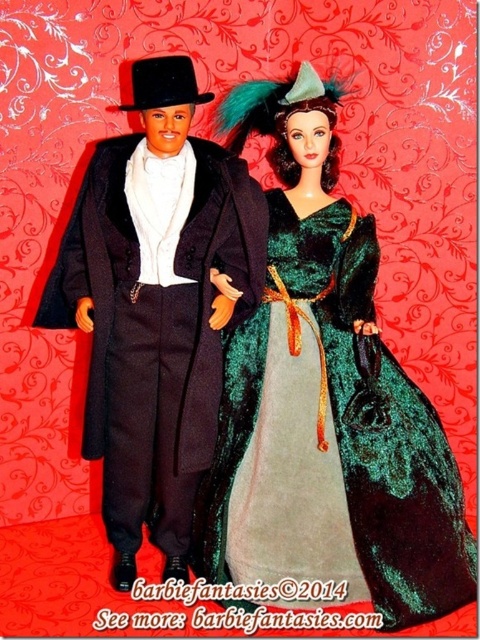
Question: Is green velvet dress at center further to camera compared to matte black suit at center?

Choices:
 (A) no
 (B) yes

Answer: (B)

Question: Is green velvet dress at center smaller than matte black suit at center?

Choices:
 (A) yes
 (B) no

Answer: (A)

Question: Is green velvet dress at center to the right of matte black suit at center from the viewer's perspective?

Choices:
 (A) yes
 (B) no

Answer: (A)

Question: Which point is farther from the camera taking this photo?

Choices:
 (A) (330, 292)
 (B) (130, 467)

Answer: (A)

Question: Which point appears farthest from the camera in this image?

Choices:
 (A) coord(370,320)
 (B) coord(167,282)

Answer: (A)

Question: Which of the following is the farthest from the observer?

Choices:
 (A) matte black suit at center
 (B) green velvet dress at center

Answer: (B)